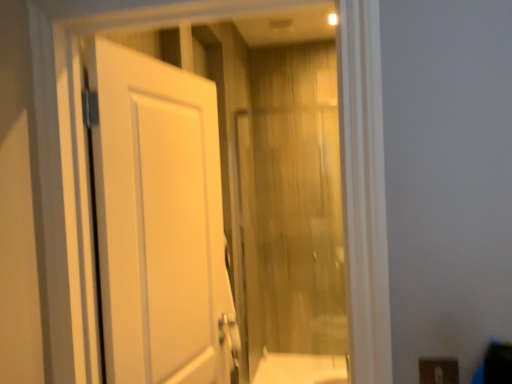
Describe the element at coordinates (159, 221) in the screenshot. This screenshot has height=384, width=512. I see `white matte door at left` at that location.

Describe the element at coordinates (298, 200) in the screenshot. I see `translucent wood curtain at center` at that location.

What is the approximate height of brown matte electric outlet at lower right?

brown matte electric outlet at lower right is 3.91 inches in height.

Identify the location of white matte door at left. The image size is (512, 384). (x=159, y=221).

Is point (197, 365) positioned after point (442, 370)?

Yes, point (197, 365) is behind point (442, 370).

Consider the image. Is white matte door at left turned away from brown matte electric outlet at lower right?

No.

Can you confirm if white matte door at left is positioned to the left of brown matte electric outlet at lower right?

Indeed, white matte door at left is positioned on the left side of brown matte electric outlet at lower right.

Looking at this image, can we say white matte door at left lies outside brown matte electric outlet at lower right?

Indeed, white matte door at left is completely outside brown matte electric outlet at lower right.

Does point (457, 362) come farther from viewer compared to point (99, 39)?

No.

In the image, there is a brown matte electric outlet at lower right. Identify the location of door above it (from the image's perspective). (159, 221).

Could you tell me if brown matte electric outlet at lower right is turned towards white matte door at left?

No, brown matte electric outlet at lower right is not turned towards white matte door at left.

Does brown matte electric outlet at lower right have a greater height compared to white matte door at left?

No, brown matte electric outlet at lower right is not taller than white matte door at left.

Which of these two, white matte door at left or translucent wood curtain at center, is bigger?

With larger size is white matte door at left.

Does point (174, 81) come farther from viewer compared to point (295, 199)?

No.

Is translucent wood curtain at center surrounded by white matte door at left?

No, translucent wood curtain at center is not a part of white matte door at left.

Considering the relative positions of white matte door at left and translucent wood curtain at center in the image provided, is white matte door at left to the left or to the right of translucent wood curtain at center?

From the image, it's evident that white matte door at left is to the left of translucent wood curtain at center.

Which of these two, translucent wood curtain at center or white matte door at left, stands taller?

With more height is translucent wood curtain at center.

Is translucent wood curtain at center not inside white matte door at left?

Indeed, translucent wood curtain at center is completely outside white matte door at left.

Does translucent wood curtain at center come behind white matte door at left?

Yes, translucent wood curtain at center is behind white matte door at left.

Considering the relative positions of translucent wood curtain at center and white matte door at left in the image provided, is translucent wood curtain at center to the left of white matte door at left from the viewer's perspective?

Incorrect, translucent wood curtain at center is not on the left side of white matte door at left.

What's the angular difference between translucent wood curtain at center and brown matte electric outlet at lower right's facing directions?

The facing directions of translucent wood curtain at center and brown matte electric outlet at lower right are 3.41 degrees apart.

Is point (329, 168) closer or farther from the camera than point (437, 367)?

Point (329, 168) is farther from the camera than point (437, 367).

Looking at this image, is translucent wood curtain at center in contact with brown matte electric outlet at lower right?

There is a gap between translucent wood curtain at center and brown matte electric outlet at lower right.

Where is `curtain on the left of brown matte electric outlet at lower right`? The image size is (512, 384). curtain on the left of brown matte electric outlet at lower right is located at coordinates (298, 200).

Looking at this image, which is behind, brown matte electric outlet at lower right or translucent wood curtain at center?

translucent wood curtain at center is further away from the camera.

From the image's perspective, is brown matte electric outlet at lower right above or below translucent wood curtain at center?

From the image's perspective, brown matte electric outlet at lower right appears below translucent wood curtain at center.

From a real-world perspective, which is physically above, brown matte electric outlet at lower right or translucent wood curtain at center?

brown matte electric outlet at lower right is physically above.

Is point (428, 383) less distant than point (287, 346)?

Yes, point (428, 383) is in front of point (287, 346).

There is a brown matte electric outlet at lower right. Identify the location of door above it (from a real-world perspective). (x=159, y=221).

Find the location of a particular element. electric outlet located on the right of white matte door at left is located at coordinates (438, 370).

When comparing their distances from translucent wood curtain at center, does white matte door at left or brown matte electric outlet at lower right seem further?

brown matte electric outlet at lower right is further to translucent wood curtain at center.

Considering their positions, is brown matte electric outlet at lower right positioned further to translucent wood curtain at center than white matte door at left?

The object further to translucent wood curtain at center is brown matte electric outlet at lower right.

Based on their spatial positions, is white matte door at left or translucent wood curtain at center further from brown matte electric outlet at lower right?

translucent wood curtain at center is further to brown matte electric outlet at lower right.

Looking at the image, which one is located closer to white matte door at left, brown matte electric outlet at lower right or translucent wood curtain at center?

brown matte electric outlet at lower right.

Looking at the image, which one is located closer to white matte door at left, translucent wood curtain at center or brown matte electric outlet at lower right?

brown matte electric outlet at lower right is positioned closer to the anchor white matte door at left.

Based on their spatial positions, is translucent wood curtain at center or white matte door at left closer to brown matte electric outlet at lower right?

Among the two, white matte door at left is located nearer to brown matte electric outlet at lower right.

The height and width of the screenshot is (384, 512). What are the coordinates of `door between brown matte electric outlet at lower right and translucent wood curtain at center in the front-back direction` in the screenshot? It's located at (159, 221).